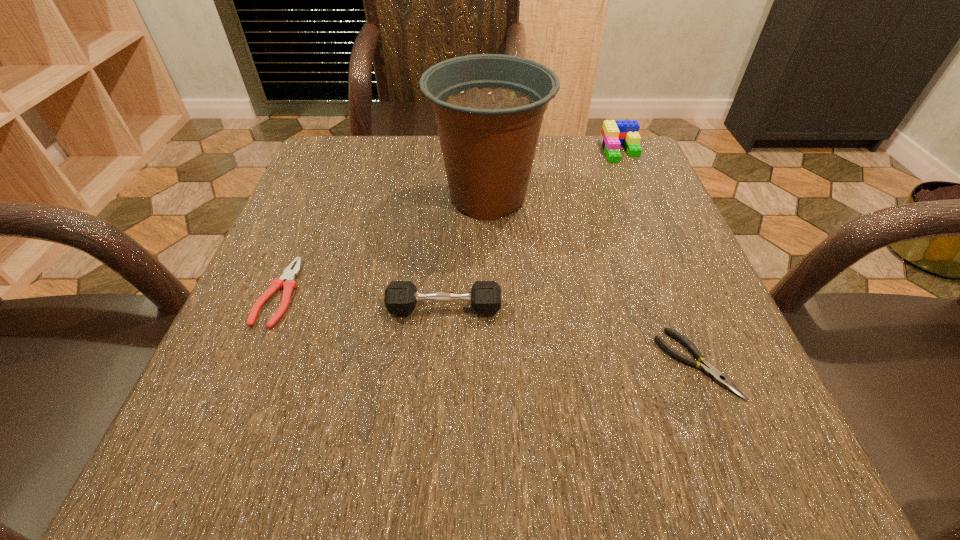
Image resolution: width=960 pixels, height=540 pixels. Identify the location of blank region between the nearer pliers and the farthest object. [659, 257].

The image size is (960, 540). Identify the location of free space between the tallest object and the dumbbell. coord(466,252).

At what (x,y) coordinates should I click in order to perform the action: click on free spot between the nearer pliers and the left pliers. Please return your answer as a coordinate pair (x, y). Looking at the image, I should click on (488, 328).

The width and height of the screenshot is (960, 540). In order to click on blank region between the second farthest object and the farthest object in this screenshot , I will do `click(554, 174)`.

Locate an element on the screen. free space between the left pliers and the nearer pliers is located at coordinates (488, 328).

Identify the location of the fourth closest object relative to the nearest object. This screenshot has height=540, width=960. (287, 281).

You are a GUI agent. You are given a task and a screenshot of the screen. Output one action in this format:
    pyautogui.click(x=<x>, y=<y>)
    Task: Click on the fourth closest object to the Lego
    This screenshot has height=540, width=960.
    Given the screenshot: What is the action you would take?
    pyautogui.click(x=287, y=281)

Where is `blank space that satisfies the following two spatial constraints: 1. on the back side of the farthest object; 2. on the left side of the nearest object`? This screenshot has height=540, width=960. blank space that satisfies the following two spatial constraints: 1. on the back side of the farthest object; 2. on the left side of the nearest object is located at coordinates (612, 151).

What are the coordinates of `vacant space that satisfies the following two spatial constraints: 1. on the front side of the dumbbell; 2. on the left side of the left pliers` in the screenshot? It's located at (273, 307).

Locate an element on the screen. The height and width of the screenshot is (540, 960). vacant position in the image that satisfies the following two spatial constraints: 1. on the back side of the fourth nearest object; 2. on the left side of the leftmost object is located at coordinates point(320,198).